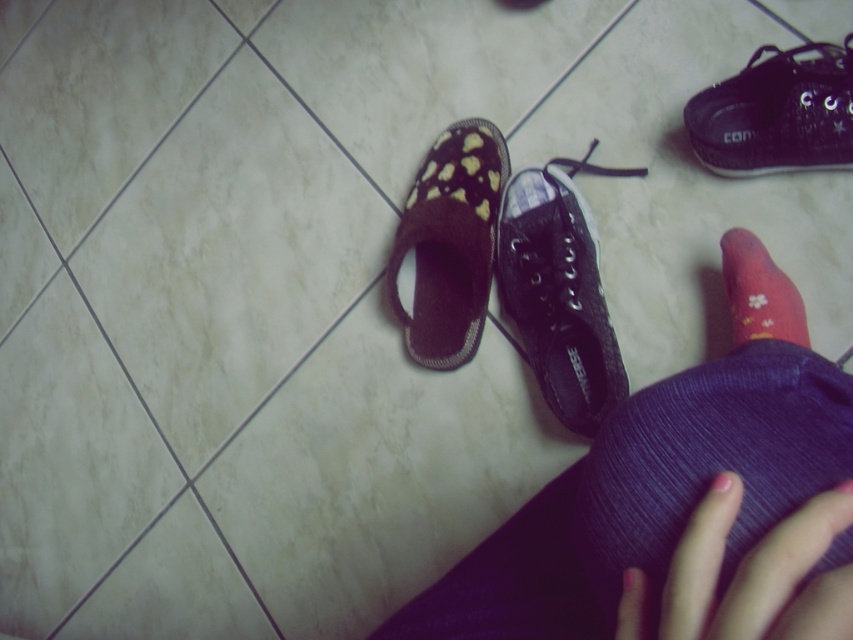
Can you confirm if purple fabric pants at center is smaller than pink floral sock at lower right?

No, purple fabric pants at center is not smaller than pink floral sock at lower right.

Is purple fabric pants at center thinner than pink floral sock at lower right?

Incorrect, purple fabric pants at center's width is not less than pink floral sock at lower right's.

Image resolution: width=853 pixels, height=640 pixels. I want to click on purple fabric pants at center, so click(682, 500).

Between brown fuzzy slipper at center-left and pink floral sock at lower right, which one appears on the right side from the viewer's perspective?

pink floral sock at lower right is more to the right.

Who is lower down, brown fuzzy slipper at center-left or pink floral sock at lower right?

Positioned lower is pink floral sock at lower right.

Identify the location of brown fuzzy slipper at center-left. (450, 243).

Is purple fabric pants at center taller than pink matte toe at center?

Correct, purple fabric pants at center is much taller as pink matte toe at center.

Does purple fabric pants at center appear over pink matte toe at center?

Actually, purple fabric pants at center is below pink matte toe at center.

I want to click on purple fabric pants at center, so click(682, 500).